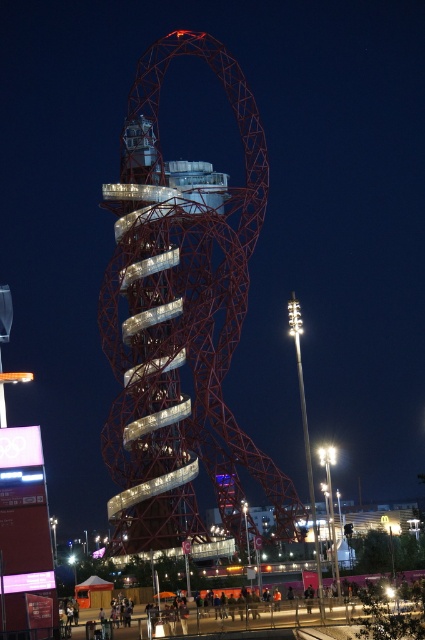
Based on the photo, you are planning to install a new walkway between the metallic red tower at center and the metallic amusement park at lower center. The walkway requires a minimum clearance of 30 meters between the two structures. Based on the scene, will the walkway fit?

The distance between the metallic red tower at center and the metallic amusement park at lower center is 29.45 meters, which is less than the required 30 meters. Therefore, the walkway will not fit.

In the scene shown: You are standing at the entrance of the amusement park and want to take a photo of both the metallic red tower at center and the metallic amusement park at lower center. Which object should you zoom in on first to ensure both fit in the frame?

The metallic red tower at center is bigger than the metallic amusement park at lower center, so you should zoom out first to include the larger metallic red tower at center, then adjust to ensure the smaller metallic amusement park at lower center also fits in the frame.